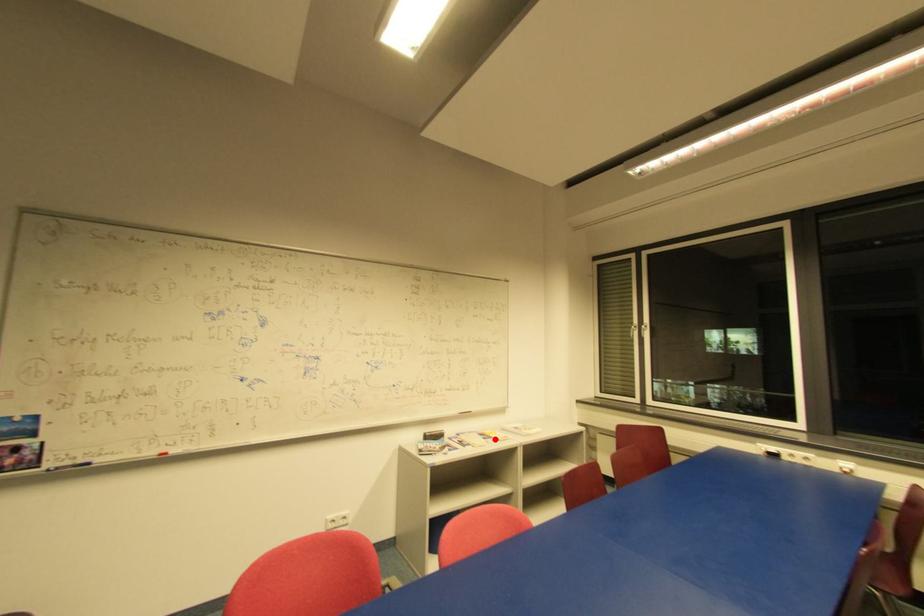
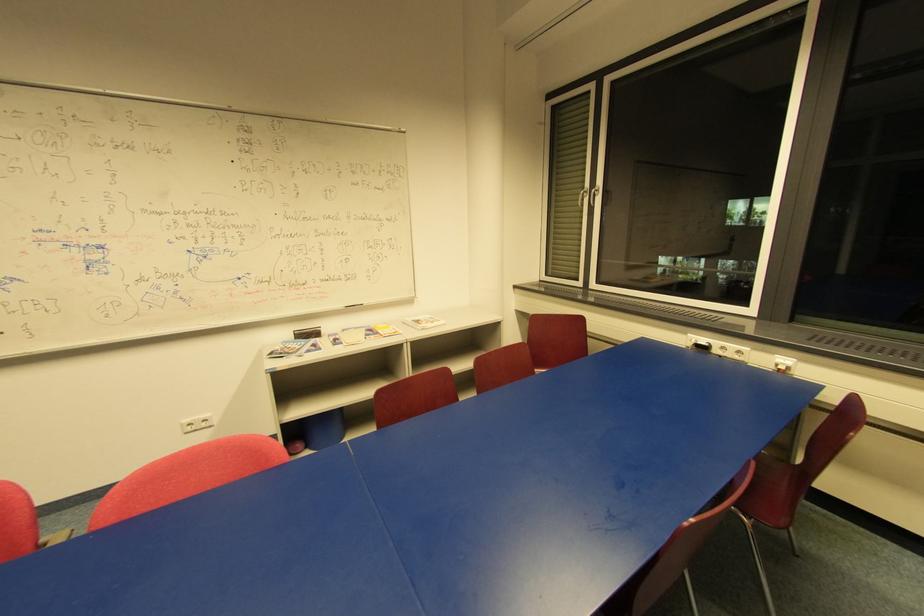
In the second image, find the point that corresponds to the highlighted location in the first image.

(381, 334)